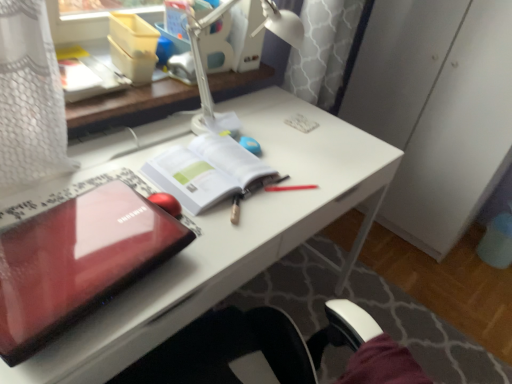
Question: Would you say white paper at center is outside glossy plastic laptop at left?

Choices:
 (A) no
 (B) yes

Answer: (B)

Question: Can you confirm if white paper at center is positioned to the right of glossy plastic laptop at left?

Choices:
 (A) no
 (B) yes

Answer: (B)

Question: Is white paper at center far from glossy plastic laptop at left?

Choices:
 (A) yes
 (B) no

Answer: (B)

Question: Is white paper at center facing towards glossy plastic laptop at left?

Choices:
 (A) no
 (B) yes

Answer: (A)

Question: Considering the relative positions of white paper at center and glossy plastic laptop at left in the image provided, is white paper at center to the left of glossy plastic laptop at left from the viewer's perspective?

Choices:
 (A) no
 (B) yes

Answer: (A)

Question: Does point (59, 355) appear closer or farther from the camera than point (223, 142)?

Choices:
 (A) closer
 (B) farther

Answer: (A)

Question: Based on their positions, is glossy plastic laptop at center-left located to the left or right of white paper at center?

Choices:
 (A) left
 (B) right

Answer: (A)

Question: From a real-world perspective, is glossy plastic laptop at center-left above or below white paper at center?

Choices:
 (A) above
 (B) below

Answer: (B)

Question: Considering their positions, is glossy plastic laptop at center-left located in front of or behind white paper at center?

Choices:
 (A) front
 (B) behind

Answer: (A)

Question: In terms of size, does white plastic lamp at upper center appear bigger or smaller than glossy plastic laptop at left?

Choices:
 (A) big
 (B) small

Answer: (A)

Question: In terms of height, does white plastic lamp at upper center look taller or shorter compared to glossy plastic laptop at left?

Choices:
 (A) short
 (B) tall

Answer: (B)

Question: From the image's perspective, is white plastic lamp at upper center above or below glossy plastic laptop at left?

Choices:
 (A) below
 (B) above

Answer: (B)

Question: In the image, is white plastic lamp at upper center positioned in front of or behind glossy plastic laptop at left?

Choices:
 (A) front
 (B) behind

Answer: (B)

Question: From a real-world perspective, relative to glossy plastic laptop at center-left, is glossy plastic laptop at left vertically above or below?

Choices:
 (A) below
 (B) above

Answer: (B)

Question: Relative to glossy plastic laptop at center-left, is glossy plastic laptop at left in front or behind?

Choices:
 (A) front
 (B) behind

Answer: (A)